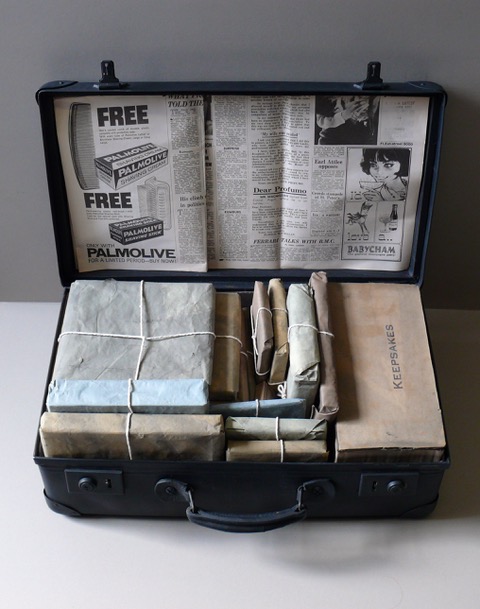
Find the location of `box`. box is located at coordinates (382, 400).